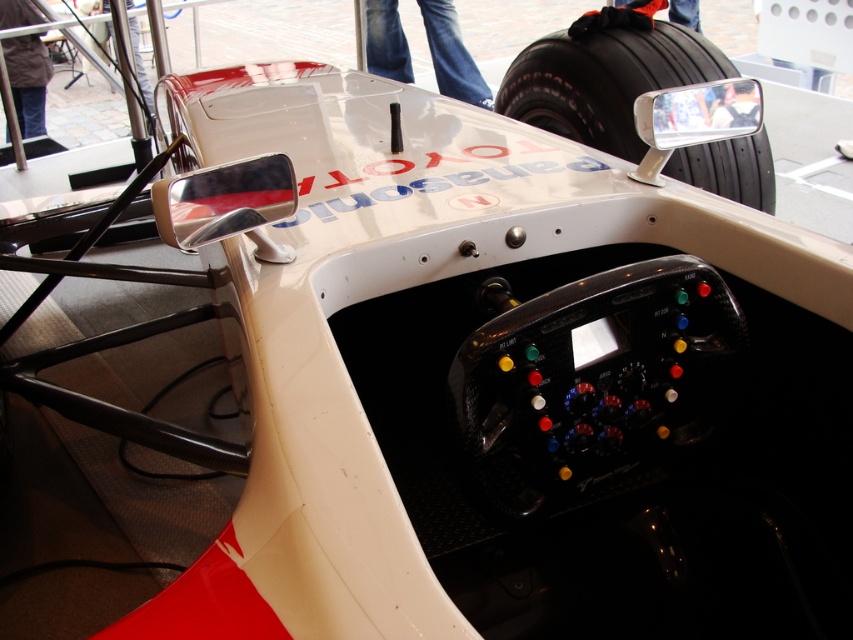
Question: Considering the relative positions of black rubber tire at upper right and jeans at upper center in the image provided, where is black rubber tire at upper right located with respect to jeans at upper center?

Choices:
 (A) left
 (B) right

Answer: (B)

Question: Among these objects, which one is nearest to the camera?

Choices:
 (A) black rubber tire at upper right
 (B) jeans at upper center

Answer: (A)

Question: Is black rubber tire at upper right positioned behind jeans at upper center?

Choices:
 (A) yes
 (B) no

Answer: (B)

Question: Can you confirm if black rubber tire at upper right is positioned below jeans at upper center?

Choices:
 (A) yes
 (B) no

Answer: (A)

Question: Which object appears farthest from the camera in this image?

Choices:
 (A) black rubber tire at upper right
 (B) jeans at upper center

Answer: (B)

Question: Which point appears farthest from the camera in this image?

Choices:
 (A) (631, 58)
 (B) (450, 33)

Answer: (B)